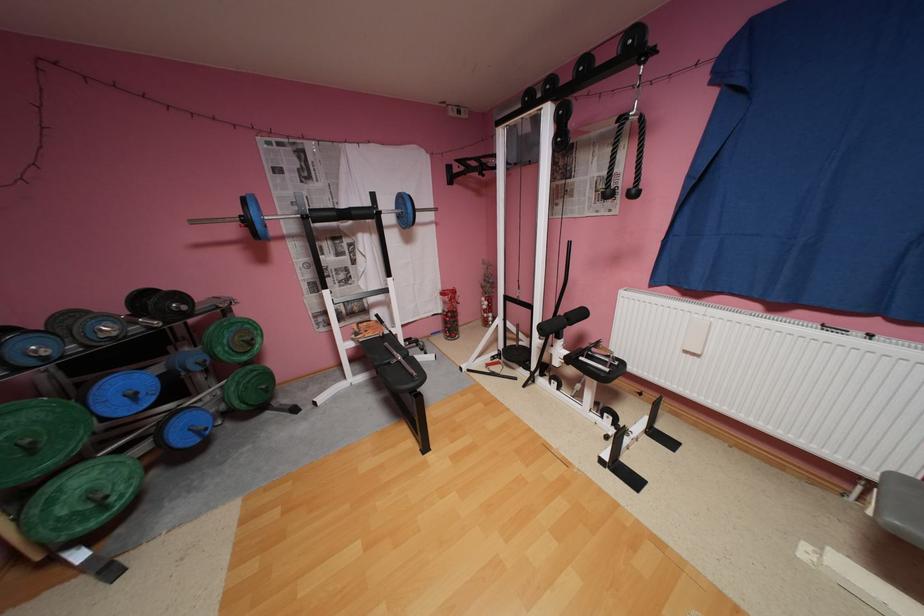
You are a GUI agent. You are given a task and a screenshot of the screen. Output one action in this format:
    pyautogui.click(x=<x>, y=<y>)
    Task: Click on the machine side handle
    
    Given the screenshot: What is the action you would take?
    pyautogui.click(x=562, y=321)